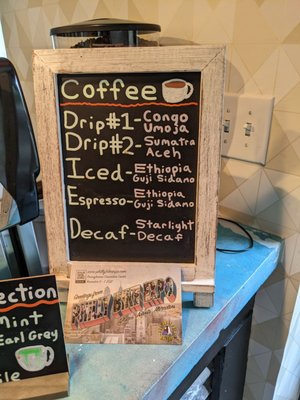
The width and height of the screenshot is (300, 400). Find the location of `coffee cup illustrate`. coffee cup illustrate is located at coordinates (179, 94).